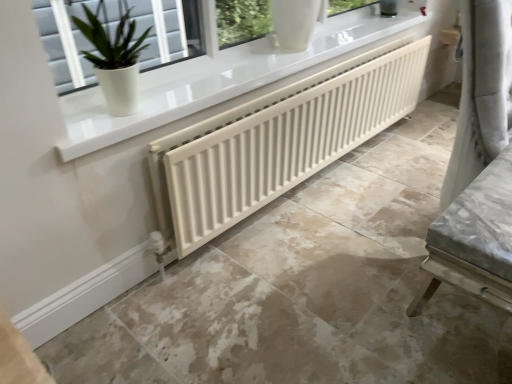
What do you see at coordinates (276, 142) in the screenshot?
I see `white matte radiator at center` at bounding box center [276, 142].

This screenshot has width=512, height=384. I want to click on white glossy pot at upper left, so click(x=168, y=31).

Does point (176, 263) come behind point (52, 70)?

No, it is not.

Which is behind, white matte radiator at center or white glossy pot at upper left?

Positioned behind is white glossy pot at upper left.

Is white matte radiator at center facing away from white glossy pot at upper left?

No, white matte radiator at center is not facing the opposite direction of white glossy pot at upper left.

In terms of width, does white matte radiator at center look wider or thinner when compared to white glossy pot at upper left?

Clearly, white matte radiator at center has more width compared to white glossy pot at upper left.

Would you say white glossy pot at upper left is a long distance from white matte radiator at center?

That's right, there is a large distance between white glossy pot at upper left and white matte radiator at center.

Looking at this image, which object is closer to the camera taking this photo, white glossy pot at upper left or white matte radiator at center?

white matte radiator at center.

From a real-world perspective, relative to white matte radiator at center, is white glossy pot at upper left vertically above or below?

Clearly, from a real-world perspective, white glossy pot at upper left is above white matte radiator at center.

How distant is white glossy pot at upper left from white matte radiator at center?

white glossy pot at upper left is 5.15 feet away from white matte radiator at center.

Which is more to the right, white matte radiator at center or white glossy pot at upper left?

white matte radiator at center is more to the right.

Which object is wider, white matte radiator at center or white glossy pot at upper left?

With larger width is white glossy pot at upper left.

Considering the relative positions of white matte radiator at center and white glossy pot at upper left in the image provided, is white matte radiator at center behind white glossy pot at upper left?

Yes, it is behind white glossy pot at upper left.

Who is shorter, white matte radiator at center or white glossy pot at upper left?

Standing shorter between the two is white glossy pot at upper left.

From a real-world perspective, is white matte radiator at center below white matte radiator at center?

Yes, from a real-world perspective, white matte radiator at center is beneath white matte radiator at center.

Looking at this image, considering the relative positions of white matte radiator at center and white matte radiator at center in the image provided, is white matte radiator at center to the right of white matte radiator at center from the viewer's perspective?

Yes, white matte radiator at center is to the right of white matte radiator at center.

Does white matte radiator at center have a greater height compared to white matte radiator at center?

No, white matte radiator at center is not taller than white matte radiator at center.

Considering the positions of points (448, 129) and (228, 148), is point (448, 129) closer to camera compared to point (228, 148)?

No, (448, 129) is behind (228, 148).

Is white glossy pot at upper left facing away from white matte radiator at center?

No, white glossy pot at upper left is not facing away from white matte radiator at center.

Can we say white glossy pot at upper left lies outside white matte radiator at center?

Yes, white glossy pot at upper left is not within white matte radiator at center.

Which object is more forward, white glossy pot at upper left or white matte radiator at center?

white glossy pot at upper left.

Would you say white matte radiator at center is inside or outside white matte radiator at center?

white matte radiator at center lies outside white matte radiator at center.

From the image's perspective, is white matte radiator at center located above or below white matte radiator at center?

From the image's perspective, white matte radiator at center appears above white matte radiator at center.

Which object is wider, white matte radiator at center or white matte radiator at center?

With larger width is white matte radiator at center.

Is white matte radiator at center looking in the opposite direction of white matte radiator at center?

No.

What are the coordinates of `concrete that is on the right side of white glossy pot at upper left` in the screenshot? It's located at (308, 288).

In the image, there is a white glossy pot at upper left. At what (x,y) coordinates should I click in order to perform the action: click on concrete below it (from a real-world perspective). Please return your answer as a coordinate pair (x, y). The height and width of the screenshot is (384, 512). Looking at the image, I should click on (308, 288).

Estimate the real-world distances between objects in this image. Which object is further from white matte radiator at center, white glossy pot at upper left or white matte radiator at center?

The object further to white matte radiator at center is white glossy pot at upper left.

From the image, which object appears to be nearer to white matte radiator at center, white glossy pot at upper left or white matte radiator at center?

white matte radiator at center.

Estimate the real-world distances between objects in this image. Which object is further from white matte radiator at center, white matte radiator at center or white glossy pot at upper left?

The object further to white matte radiator at center is white glossy pot at upper left.

Based on their spatial positions, is white matte radiator at center or white matte radiator at center further from white glossy pot at upper left?

Among the two, white matte radiator at center is located further to white glossy pot at upper left.

Estimate the real-world distances between objects in this image. Which object is further from white matte radiator at center, white matte radiator at center or white glossy pot at upper left?

Among the two, white glossy pot at upper left is located further to white matte radiator at center.

Looking at this image, when comparing their distances from white glossy pot at upper left, does white matte radiator at center or white matte radiator at center seem further?

Among the two, white matte radiator at center is located further to white glossy pot at upper left.

Find the location of a particular element. The height and width of the screenshot is (384, 512). radiator between white glossy pot at upper left and white matte radiator at center from left to right is located at coordinates (276, 142).